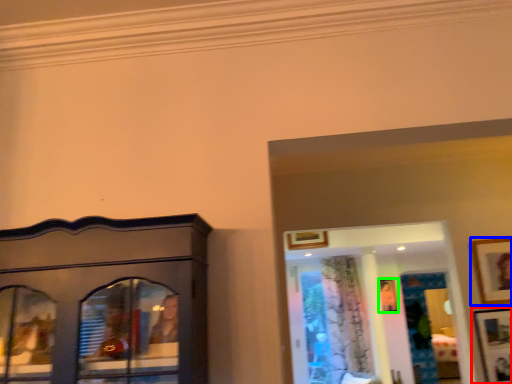
Question: Estimate the real-world distances between objects in this image. Which object is closer to picture frame (highlighted by a red box), picture frame (highlighted by a blue box) or picture frame (highlighted by a green box)?

Choices:
 (A) picture frame
 (B) picture frame

Answer: (A)